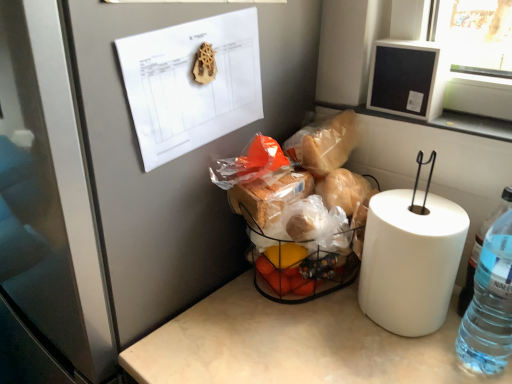
Question: Does black matte frame at upper right lie in front of white paper at upper left?

Choices:
 (A) yes
 (B) no

Answer: (B)

Question: Is the position of black matte frame at upper right more distant than that of white paper at upper left?

Choices:
 (A) no
 (B) yes

Answer: (B)

Question: Is black matte frame at upper right positioned with its back to white paper at upper left?

Choices:
 (A) no
 (B) yes

Answer: (A)

Question: Is black matte frame at upper right located outside white paper at upper left?

Choices:
 (A) yes
 (B) no

Answer: (A)

Question: From the image's perspective, is black matte frame at upper right on top of white paper at upper left?

Choices:
 (A) yes
 (B) no

Answer: (A)

Question: Is black matte frame at upper right not close to white paper at upper left?

Choices:
 (A) no
 (B) yes

Answer: (A)

Question: Considering the relative positions of wooden gear at upper center and black matte frame at upper right in the image provided, is wooden gear at upper center to the left of black matte frame at upper right from the viewer's perspective?

Choices:
 (A) no
 (B) yes

Answer: (B)

Question: Does wooden gear at upper center come in front of black matte frame at upper right?

Choices:
 (A) no
 (B) yes

Answer: (B)

Question: Does wooden gear at upper center have a greater height compared to black matte frame at upper right?

Choices:
 (A) no
 (B) yes

Answer: (A)

Question: Does wooden gear at upper center turn towards black matte frame at upper right?

Choices:
 (A) yes
 (B) no

Answer: (B)

Question: From the image's perspective, is wooden gear at upper center below black matte frame at upper right?

Choices:
 (A) no
 (B) yes

Answer: (B)

Question: Is black matte frame at upper right completely or partially inside wooden gear at upper center?

Choices:
 (A) yes
 (B) no

Answer: (B)

Question: Is white paper at upper left to the left of translucent plastic basket at center from the viewer's perspective?

Choices:
 (A) no
 (B) yes

Answer: (B)